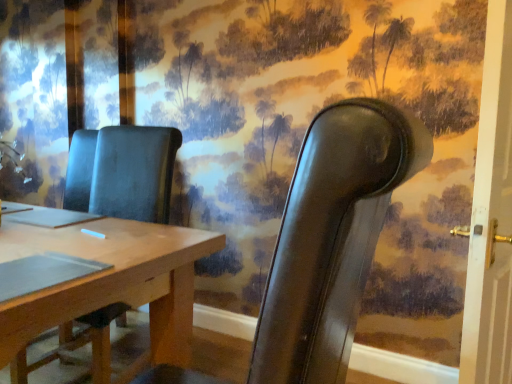
Question: Does white painted wood door at right have a greater width compared to matte brown chair at center, which is counted as the 2th chair, starting from the right?

Choices:
 (A) no
 (B) yes

Answer: (A)

Question: From a real-world perspective, is white painted wood door at right positioned under matte brown chair at center, which is counted as the 2th chair, starting from the right, based on gravity?

Choices:
 (A) yes
 (B) no

Answer: (B)

Question: Is white painted wood door at right to the right of matte brown chair at center, which is the 1th chair in left-to-right order, from the viewer's perspective?

Choices:
 (A) yes
 (B) no

Answer: (A)

Question: From the image's perspective, is white painted wood door at right beneath matte brown chair at center, which is counted as the 2th chair, starting from the right?

Choices:
 (A) no
 (B) yes

Answer: (A)

Question: Is white painted wood door at right bigger than matte brown chair at center, which is counted as the 2th chair, starting from the right?

Choices:
 (A) no
 (B) yes

Answer: (A)

Question: Considering the positions of matte brown chair at center, which is counted as the 2th chair, starting from the right, and leather chair at right, which appears as the 1th chair when viewed from the right, in the image, is matte brown chair at center, which is counted as the 2th chair, starting from the right, wider or thinner than leather chair at right, which appears as the 1th chair when viewed from the right,?

Choices:
 (A) wide
 (B) thin

Answer: (A)

Question: From their relative heights in the image, would you say matte brown chair at center, which is counted as the 2th chair, starting from the right, is taller or shorter than leather chair at right, acting as the 2th chair starting from the left?

Choices:
 (A) short
 (B) tall

Answer: (B)

Question: Considering their positions, is matte brown chair at center, which is the 1th chair in left-to-right order, located in front of or behind leather chair at right, which appears as the 1th chair when viewed from the right?

Choices:
 (A) behind
 (B) front

Answer: (A)

Question: Is matte brown chair at center, which is the 1th chair in left-to-right order, situated inside leather chair at right, which appears as the 1th chair when viewed from the right, or outside?

Choices:
 (A) inside
 (B) outside

Answer: (B)

Question: From a real-world perspective, is white painted wood door at right above or below matte brown chair at center, which is counted as the 2th chair, starting from the right?

Choices:
 (A) above
 (B) below

Answer: (A)

Question: Is white painted wood door at right bigger or smaller than matte brown chair at center, which is counted as the 2th chair, starting from the right?

Choices:
 (A) big
 (B) small

Answer: (B)

Question: Is white painted wood door at right spatially inside matte brown chair at center, which is the 1th chair in left-to-right order, or outside of it?

Choices:
 (A) outside
 (B) inside

Answer: (A)

Question: Relative to matte brown chair at center, which is the 1th chair in left-to-right order, is white painted wood door at right in front or behind?

Choices:
 (A) behind
 (B) front

Answer: (A)

Question: Which is correct: white painted wood door at right is inside leather chair at right, acting as the 2th chair starting from the left, or outside of it?

Choices:
 (A) inside
 (B) outside

Answer: (B)

Question: From the image's perspective, is white painted wood door at right located above or below leather chair at right, acting as the 2th chair starting from the left?

Choices:
 (A) above
 (B) below

Answer: (A)